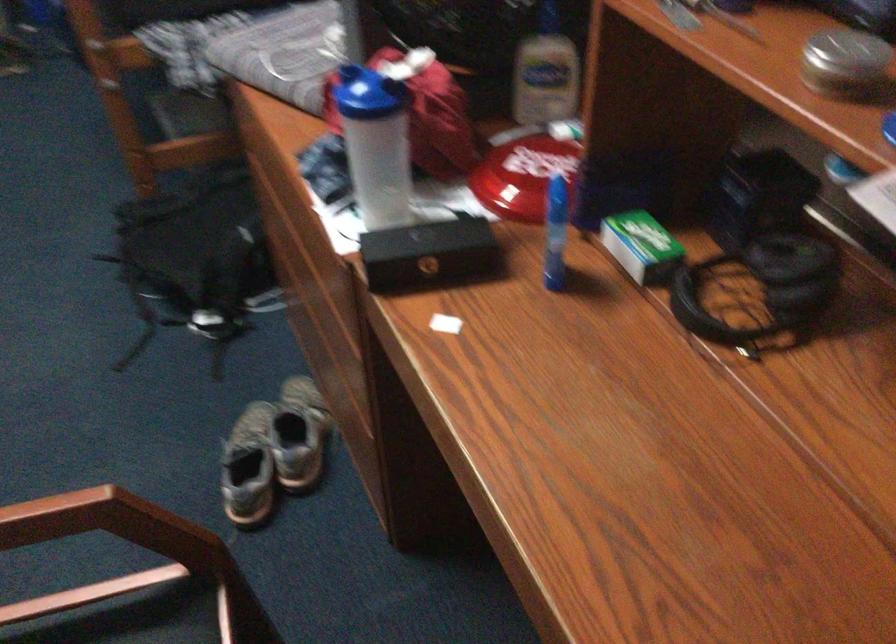
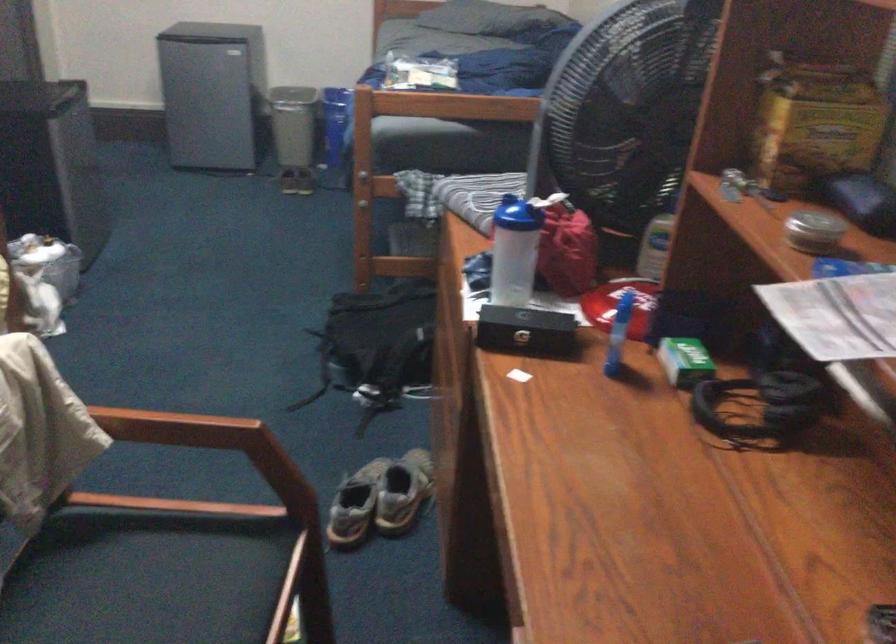
Find the pixel in the second image that matches pixel 764 275 in the first image.

(767, 397)